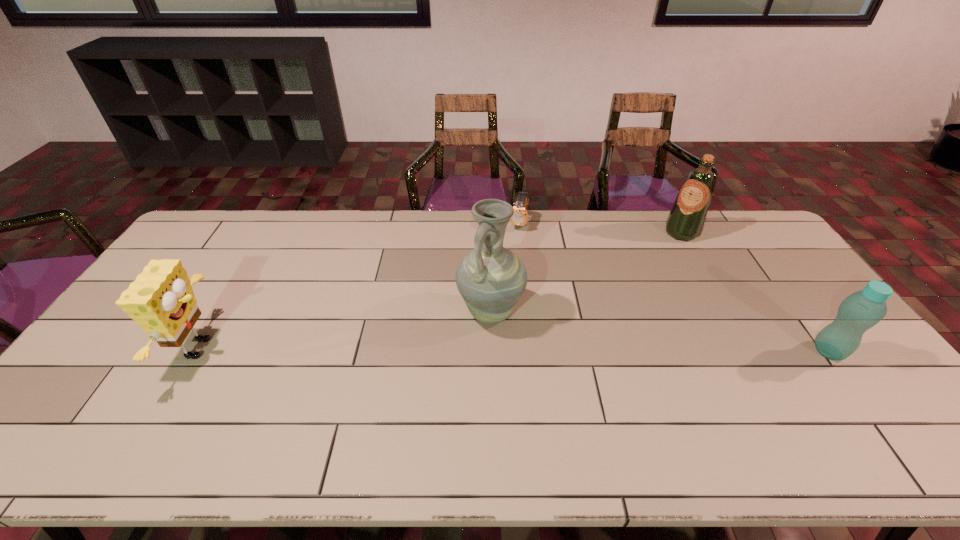
The image size is (960, 540). I want to click on free spot on the desktop that is between the leftmost object and the rightmost object and is positioned on the face of the watch, so click(x=475, y=349).

The width and height of the screenshot is (960, 540). What are the coordinates of `vacant space on the desktop that is between the leftmost object and the rightmost object and is positioned on the front-facing side of the olive oil` in the screenshot? It's located at (590, 350).

You are a GUI agent. You are given a task and a screenshot of the screen. Output one action in this format:
    pyautogui.click(x=<x>, y=<y>)
    Task: Click on the free space on the desktop that is between the sponge and the water bottle and is positioned on the handle side of the tallest object
    This screenshot has width=960, height=540.
    Given the screenshot: What is the action you would take?
    pyautogui.click(x=438, y=349)